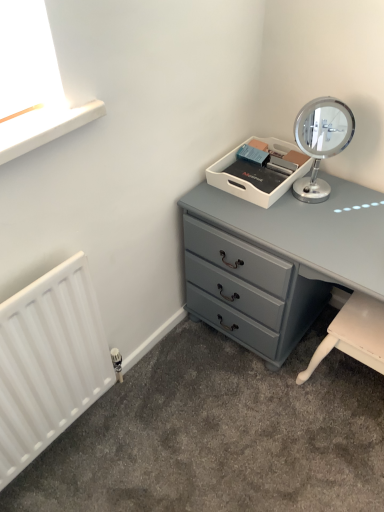
Find the location of a particular element. space that is in front of matte gray chest of drawers at center is located at coordinates (276, 450).